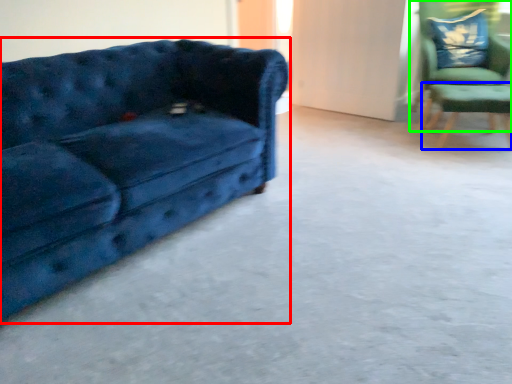
Question: Considering the real-world distances, which object is closest to studio couch (highlighted by a red box)? side table (highlighted by a blue box) or chair (highlighted by a green box).

Choices:
 (A) side table
 (B) chair

Answer: (A)